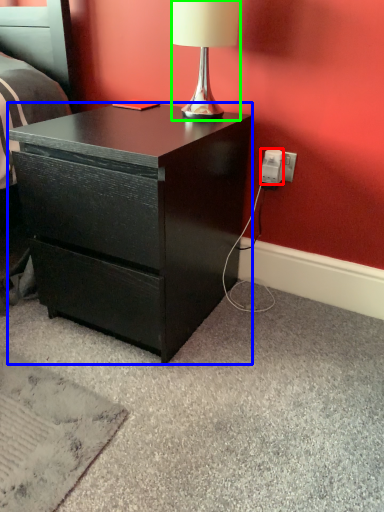
Question: Based on their relative distances, which object is farther from power outlet (highlighted by a red box)? Choose from desk (highlighted by a blue box) and lamp (highlighted by a green box).

Choices:
 (A) desk
 (B) lamp

Answer: (A)